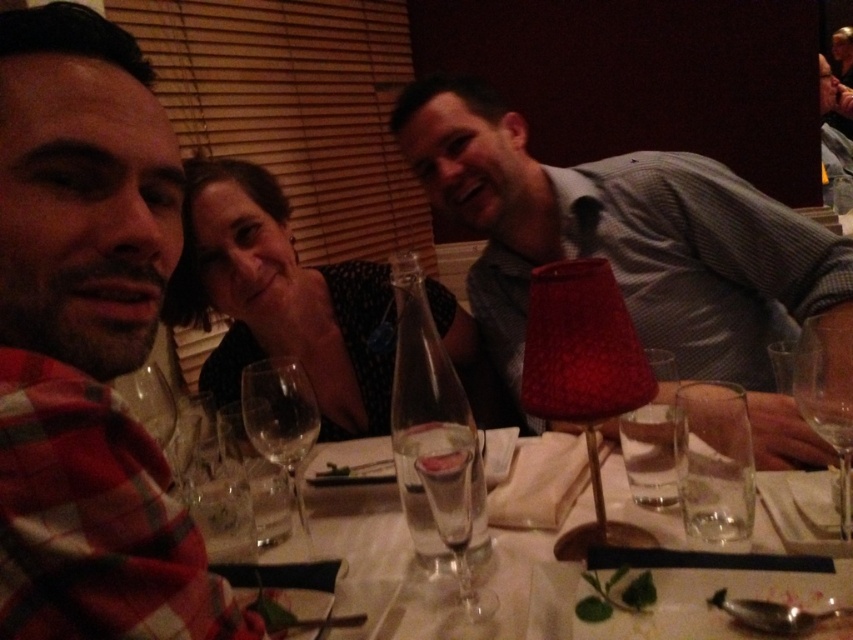
Question: Observing the image, what is the correct spatial positioning of matte black shirt at center in reference to transparent glass wine glass at right?

Choices:
 (A) right
 (B) left

Answer: (B)

Question: Is matte plaid shirt at left below matte black shirt at center?

Choices:
 (A) yes
 (B) no

Answer: (B)

Question: Does clear glass water at center lie in front of transparent glass wine glass at right?

Choices:
 (A) no
 (B) yes

Answer: (B)

Question: Which of the following is the closest to the observer?

Choices:
 (A) (77, 440)
 (B) (247, 400)
 (C) (511, 304)

Answer: (A)

Question: Based on their relative distances, which object is nearer to the matte gray shirt at center?

Choices:
 (A) transparent glass wine glass at center
 (B) matte black shirt at center
 (C) matte plaid shirt at left
 (D) clear glass water at center

Answer: (B)

Question: Which object appears farthest from the camera in this image?

Choices:
 (A) transparent glass wine glass at right
 (B) transparent glass wine glass at center
 (C) matte plaid shirt at left

Answer: (B)